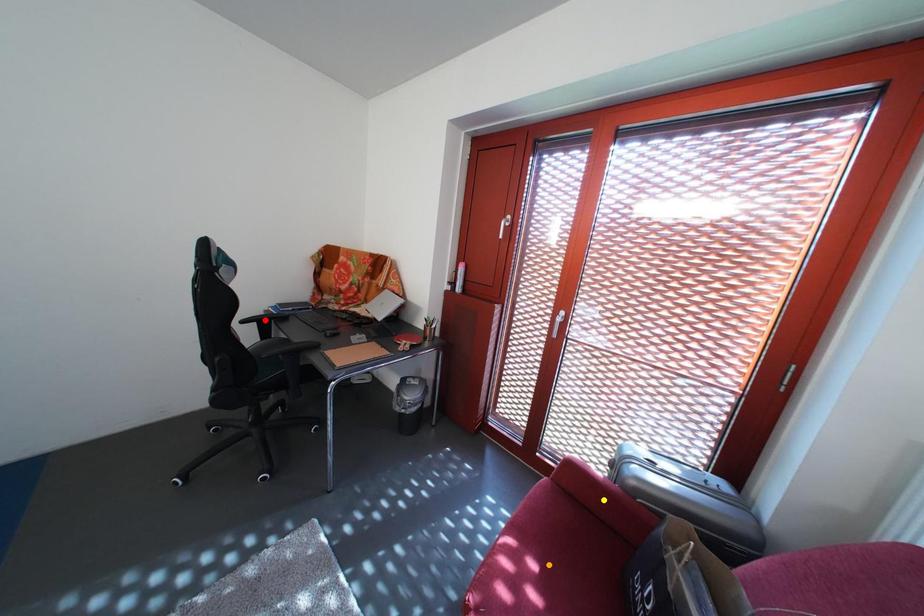
Order these from nearest to farthest:
1. orange point
2. yellow point
3. red point

red point
yellow point
orange point